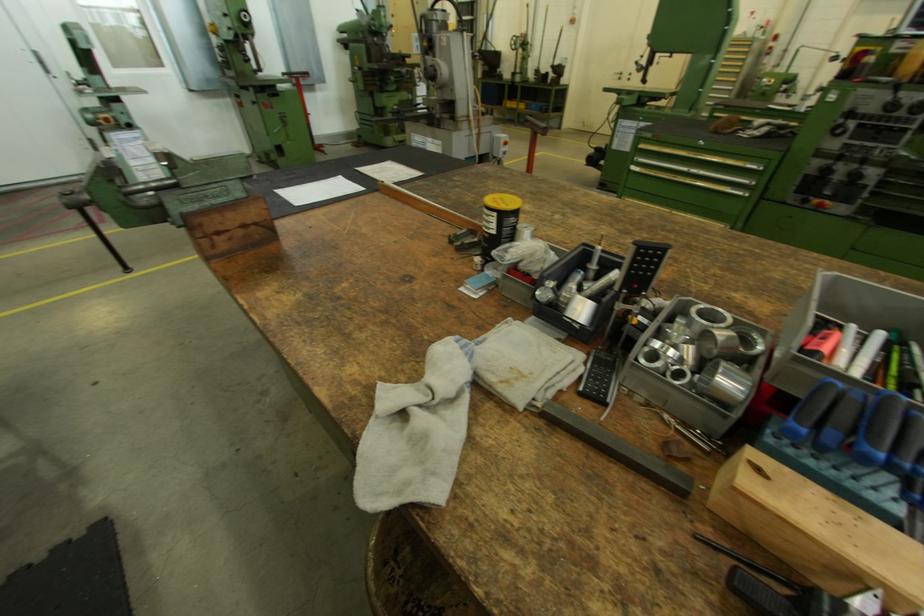
Identify the location of blue and black handle. The image size is (924, 616). (842, 419).